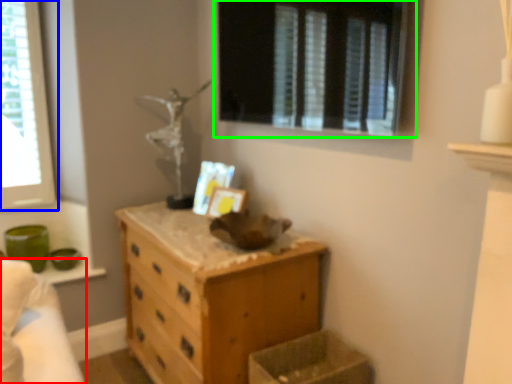
Question: Which is nearer to the bed (highlighted by a red box)? window (highlighted by a blue box) or window (highlighted by a green box).

Choices:
 (A) window
 (B) window

Answer: (A)